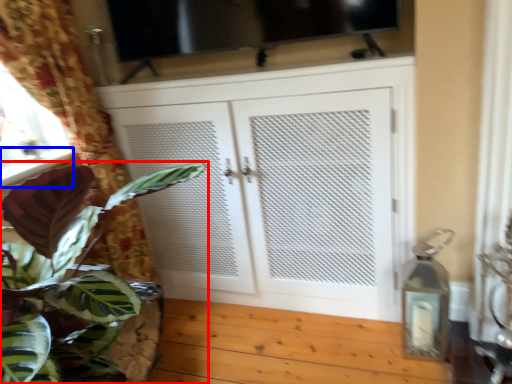
Question: Among these objects, which one is nearest to the camera, houseplant (highlighted by a red box) or window sill (highlighted by a blue box)?

Choices:
 (A) houseplant
 (B) window sill

Answer: (A)